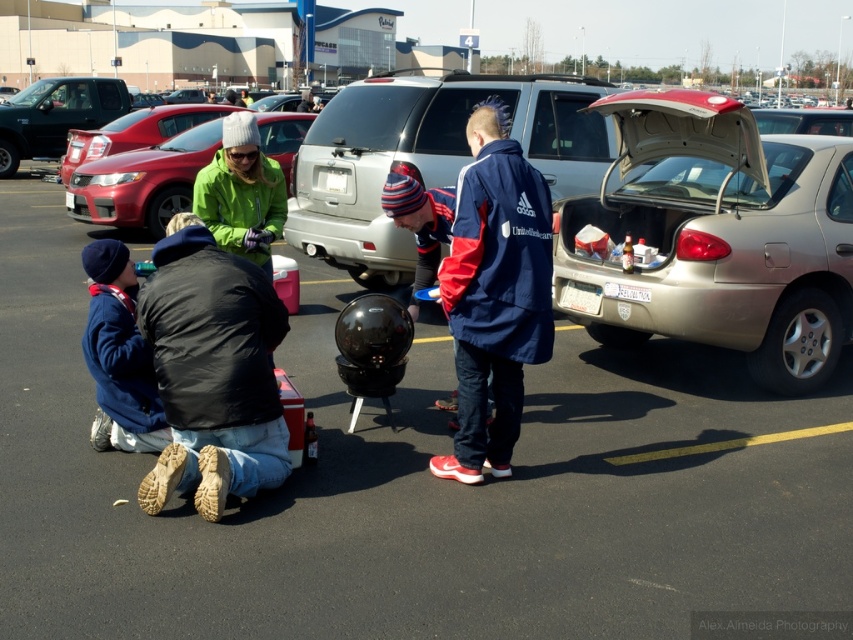
Question: Among these points, which one is nearest to the camera?

Choices:
 (A) (306, 100)
 (B) (488, 131)

Answer: (B)

Question: Does gold metallic sedan at center right appear over green fleece jacket at upper center?

Choices:
 (A) no
 (B) yes

Answer: (B)

Question: Which object appears farthest from the camera in this image?

Choices:
 (A) metallic silver suv at upper left
 (B) black matte jacket at lower left
 (C) navy blue fabric jacket at center

Answer: (A)

Question: Can you confirm if green matte jacket at upper center is thinner than green fleece jacket at upper center?

Choices:
 (A) no
 (B) yes

Answer: (A)

Question: Does navy blue fabric jacket at center appear under matte blue jacket at lower left?

Choices:
 (A) no
 (B) yes

Answer: (A)

Question: Which is nearer to the green fleece jacket at upper center?

Choices:
 (A) navy blue fabric jacket at center
 (B) green fleece jacket at center
 (C) metallic silver suv at upper left

Answer: (A)